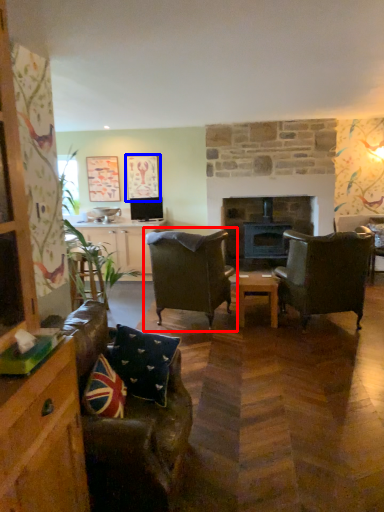
Question: Among these objects, which one is nearest to the camera, chair (highlighted by a red box) or picture frame (highlighted by a blue box)?

Choices:
 (A) chair
 (B) picture frame

Answer: (A)